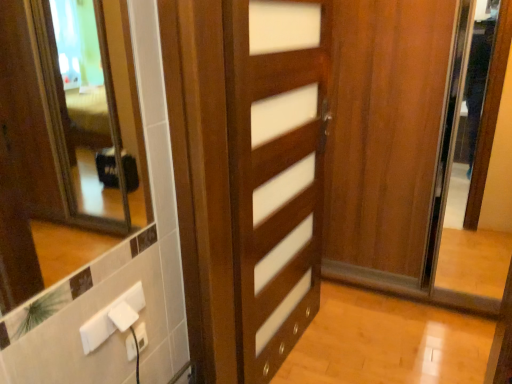
Image resolution: width=512 pixels, height=384 pixels. What are the coordinates of `white plastic electric outlet at lower left, the first electric outlet from the top` in the screenshot? It's located at (113, 318).

How much space does white plastic electric outlet at lower left, the 2th electric outlet in the bottom-to-top sequence, occupy vertically?

It is 4.31 inches.

Find the location of a particular element. This screenshot has height=384, width=512. white plastic electric outlet at lower center, which is counted as the first electric outlet, starting from the bottom is located at coordinates (141, 336).

You are a GUI agent. You are given a task and a screenshot of the screen. Output one action in this format:
    pyautogui.click(x=<x>, y=<y>)
    Task: Click on the white plastic electric outlet at lower left, the 2th electric outlet in the bottom-to-top sequence
    
    Given the screenshot: What is the action you would take?
    pyautogui.click(x=113, y=318)

From a real-world perspective, who is located lower, white plastic electric outlet at lower left, the 2th electric outlet in the bottom-to-top sequence, or wooden door at center?

In real-world perspective, white plastic electric outlet at lower left, the 2th electric outlet in the bottom-to-top sequence, is lower.

How far apart are white plastic electric outlet at lower left, the 2th electric outlet in the bottom-to-top sequence, and wooden door at center?

white plastic electric outlet at lower left, the 2th electric outlet in the bottom-to-top sequence, and wooden door at center are 30.27 inches apart.

Could you tell me if white plastic electric outlet at lower left, the first electric outlet from the top, is turned towards wooden door at center?

No.

Is white plastic electric outlet at lower left, the 2th electric outlet in the bottom-to-top sequence, closer to the viewer compared to wooden door at center?

Yes, white plastic electric outlet at lower left, the 2th electric outlet in the bottom-to-top sequence, is closer to the viewer.

Is wooden door at center next to white plastic electric outlet at lower center, which is counted as the first electric outlet, starting from the bottom, and touching it?

No, wooden door at center is not with white plastic electric outlet at lower center, which is counted as the first electric outlet, starting from the bottom.

Does wooden door at center have a greater height compared to white plastic electric outlet at lower center, positioned as the second electric outlet in top-to-bottom order?

Yes.

Is point (274, 184) positioned in front of point (139, 325)?

That is False.

Who is smaller, white plastic electric outlet at lower center, positioned as the second electric outlet in top-to-bottom order, or white plastic electric outlet at lower left, the first electric outlet from the top?

white plastic electric outlet at lower center, positioned as the second electric outlet in top-to-bottom order.

Between white plastic electric outlet at lower center, positioned as the second electric outlet in top-to-bottom order, and white plastic electric outlet at lower left, the first electric outlet from the top, which one appears on the left side from the viewer's perspective?

white plastic electric outlet at lower left, the first electric outlet from the top.

Looking at this image, is white plastic electric outlet at lower center, positioned as the second electric outlet in top-to-bottom order, oriented towards white plastic electric outlet at lower left, the 2th electric outlet in the bottom-to-top sequence?

No, white plastic electric outlet at lower center, positioned as the second electric outlet in top-to-bottom order, is not oriented towards white plastic electric outlet at lower left, the 2th electric outlet in the bottom-to-top sequence.

Is white plastic electric outlet at lower center, positioned as the second electric outlet in top-to-bottom order, at the right side of wooden door at center?

No.

Which object is closer to the camera taking this photo, white plastic electric outlet at lower center, which is counted as the first electric outlet, starting from the bottom, or wooden door at center?

wooden door at center is in front.

From a real-world perspective, is white plastic electric outlet at lower center, positioned as the second electric outlet in top-to-bottom order, physically located above or below wooden door at center?

white plastic electric outlet at lower center, positioned as the second electric outlet in top-to-bottom order, is situated lower than wooden door at center in the real world.

Looking at this image, which of these two, white plastic electric outlet at lower center, positioned as the second electric outlet in top-to-bottom order, or wooden door at center, is wider?

wooden door at center is wider.

I want to click on electric outlet above the white plastic electric outlet at lower center, which is counted as the first electric outlet, starting from the bottom (from a real-world perspective), so pos(113,318).

Can you confirm if white plastic electric outlet at lower left, the first electric outlet from the top, is bigger than white plastic electric outlet at lower center, positioned as the second electric outlet in top-to-bottom order?

Yes.

In the scene shown: Relative to white plastic electric outlet at lower center, which is counted as the first electric outlet, starting from the bottom, is white plastic electric outlet at lower left, the first electric outlet from the top, in front or behind?

Clearly, white plastic electric outlet at lower left, the first electric outlet from the top, is in front of white plastic electric outlet at lower center, which is counted as the first electric outlet, starting from the bottom.

There is a wooden door at center. Identify the location of the 1st electric outlet below it (from the image's perspective). (113, 318).

Which object is further away from the camera, wooden door at center or white plastic electric outlet at lower left, the first electric outlet from the top?

wooden door at center.

Would you say wooden door at center is outside white plastic electric outlet at lower left, the 2th electric outlet in the bottom-to-top sequence?

Yes, wooden door at center is outside of white plastic electric outlet at lower left, the 2th electric outlet in the bottom-to-top sequence.

This screenshot has height=384, width=512. What are the coordinates of `the 1st electric outlet positioned below the wooden door at center (from the image's perspective)` in the screenshot? It's located at (113, 318).

The height and width of the screenshot is (384, 512). I want to click on the 1st electric outlet to the left of the wooden door at center, counting from the anchor's position, so click(x=141, y=336).

Based on their spatial positions, is white plastic electric outlet at lower center, which is counted as the first electric outlet, starting from the bottom, or wooden door at center further from white plastic electric outlet at lower left, the 2th electric outlet in the bottom-to-top sequence?

wooden door at center.

Estimate the real-world distances between objects in this image. Which object is further from white plastic electric outlet at lower center, positioned as the second electric outlet in top-to-bottom order, wooden door at center or white plastic electric outlet at lower left, the first electric outlet from the top?

wooden door at center is further to white plastic electric outlet at lower center, positioned as the second electric outlet in top-to-bottom order.

Estimate the real-world distances between objects in this image. Which object is further from wooden door at center, white plastic electric outlet at lower left, the 2th electric outlet in the bottom-to-top sequence, or white plastic electric outlet at lower center, positioned as the second electric outlet in top-to-bottom order?

white plastic electric outlet at lower center, positioned as the second electric outlet in top-to-bottom order, is further to wooden door at center.

Which object lies nearer to the anchor point wooden door at center, white plastic electric outlet at lower center, which is counted as the first electric outlet, starting from the bottom, or white plastic electric outlet at lower left, the 2th electric outlet in the bottom-to-top sequence?

Among the two, white plastic electric outlet at lower left, the 2th electric outlet in the bottom-to-top sequence, is located nearer to wooden door at center.

Estimate the real-world distances between objects in this image. Which object is further from white plastic electric outlet at lower center, positioned as the second electric outlet in top-to-bottom order, white plastic electric outlet at lower left, the first electric outlet from the top, or wooden door at center?

wooden door at center lies further to white plastic electric outlet at lower center, positioned as the second electric outlet in top-to-bottom order, than the other object.

Estimate the real-world distances between objects in this image. Which object is further from white plastic electric outlet at lower left, the first electric outlet from the top, wooden door at center or white plastic electric outlet at lower center, which is counted as the first electric outlet, starting from the bottom?

Among the two, wooden door at center is located further to white plastic electric outlet at lower left, the first electric outlet from the top.

Find the location of a particular element. This screenshot has height=384, width=512. electric outlet between white plastic electric outlet at lower left, the first electric outlet from the top, and wooden door at center is located at coordinates (141, 336).